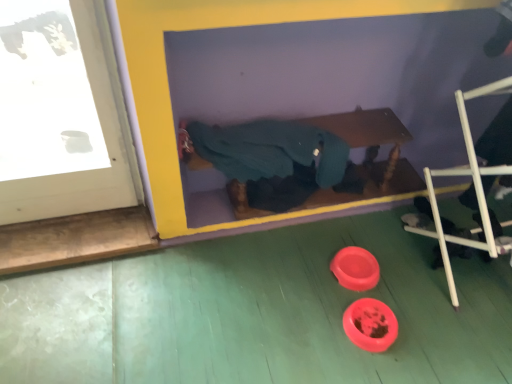
Question: Looking at their shapes, would you say white plastic ladder at lower right is wider or thinner than teal fabric at center?

Choices:
 (A) wide
 (B) thin

Answer: (A)

Question: Does point (507, 248) appear closer or farther from the camera than point (256, 183)?

Choices:
 (A) farther
 (B) closer

Answer: (B)

Question: Based on their positions, is white plastic ladder at lower right located to the left or right of teal fabric at center?

Choices:
 (A) right
 (B) left

Answer: (A)

Question: Do you think teal fabric at center is within white plastic ladder at lower right, or outside of it?

Choices:
 (A) inside
 (B) outside

Answer: (B)

Question: Is point (285, 153) closer or farther from the camera than point (505, 81)?

Choices:
 (A) closer
 (B) farther

Answer: (A)

Question: Considering their positions, is teal fabric at center located in front of or behind white plastic ladder at lower right?

Choices:
 (A) front
 (B) behind

Answer: (B)

Question: From the image's perspective, is teal fabric at center above or below white plastic ladder at lower right?

Choices:
 (A) above
 (B) below

Answer: (A)